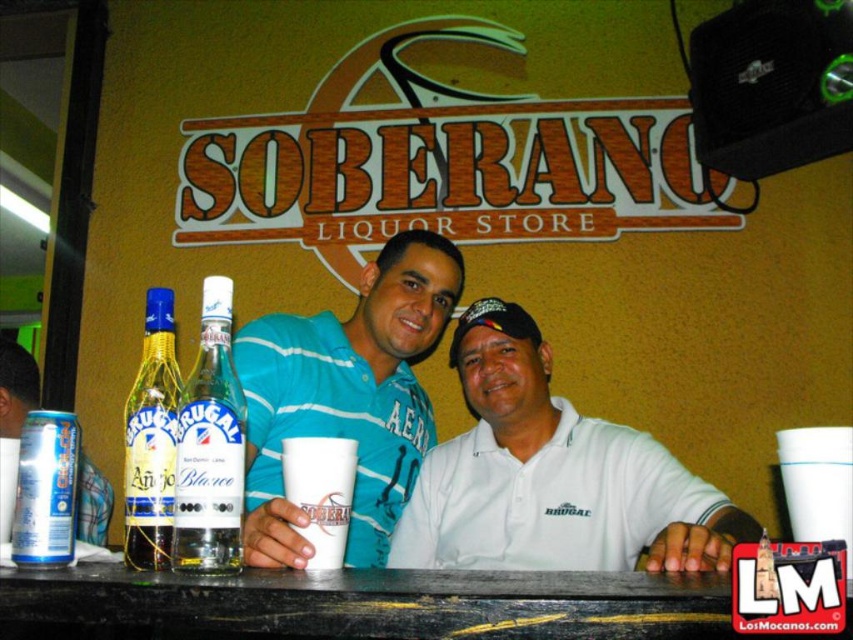
Question: Does clear glass bottle at left appear on the right side of matte glass bottle at left?

Choices:
 (A) no
 (B) yes

Answer: (B)

Question: Based on their relative distances, which object is nearer to the teal striped polo shirt at center?

Choices:
 (A) matte glass bottle at left
 (B) clear glass bottle at left
 (C) silver metallic can at lower left

Answer: (B)

Question: Among these objects, which one is farthest from the camera?

Choices:
 (A) clear glass bottle at center
 (B) teal striped polo shirt at center
 (C) matte glass bottle at left

Answer: (C)

Question: Does clear glass bottle at left come in front of silver metallic can at lower left?

Choices:
 (A) yes
 (B) no

Answer: (B)

Question: Does clear glass bottle at left have a smaller size compared to white paper cup at center?

Choices:
 (A) yes
 (B) no

Answer: (B)

Question: Which point appears closest to the camera in this image?

Choices:
 (A) (189, 417)
 (B) (387, 291)
 (C) (158, 346)

Answer: (A)